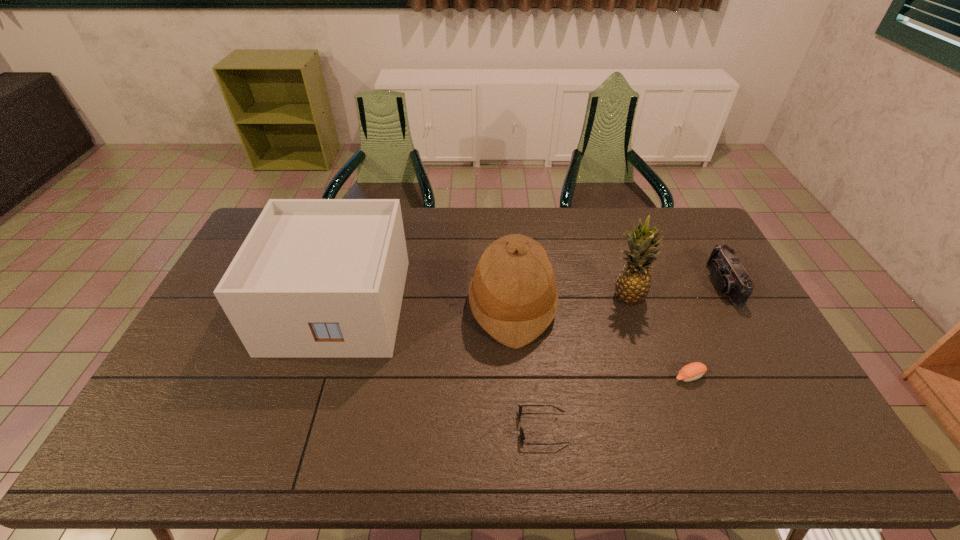
At what (x,y) coordinates should I click in order to perform the action: click on free location located on the front-facing side of the hat. Please return your answer as a coordinate pair (x, y). The width and height of the screenshot is (960, 540). Looking at the image, I should click on (431, 305).

Where is `vacant region located 0.340m on the front-facing side of the hat`? The height and width of the screenshot is (540, 960). vacant region located 0.340m on the front-facing side of the hat is located at coordinates (363, 305).

Locate an element on the screen. free region located on the front-facing side of the hat is located at coordinates (347, 305).

You are a GUI agent. You are given a task and a screenshot of the screen. Output one action in this format:
    pyautogui.click(x=<x>, y=<y>)
    Task: Click on the vacant area situated 0.200m on the side of the box with the window
    
    Given the screenshot: What is the action you would take?
    pyautogui.click(x=301, y=423)

This screenshot has height=540, width=960. I want to click on vacant space located on the front-facing side of the camcorder, so click(x=697, y=285).

Where is `free space located on the front-facing side of the camcorder`? free space located on the front-facing side of the camcorder is located at coordinates (697, 285).

Locate an element on the screen. The height and width of the screenshot is (540, 960). free spot located on the front-facing side of the camcorder is located at coordinates (649, 285).

I want to click on vacant position located on the back of the second shortest object, so click(665, 317).

Find the location of `vacant area located 0.080m on the front-facing side of the shortest object`. vacant area located 0.080m on the front-facing side of the shortest object is located at coordinates (487, 428).

At what (x,y) coordinates should I click in order to perform the action: click on vacant region located 0.260m on the front-facing side of the shortest object. Please return your answer as a coordinate pair (x, y). Looking at the image, I should click on (416, 428).